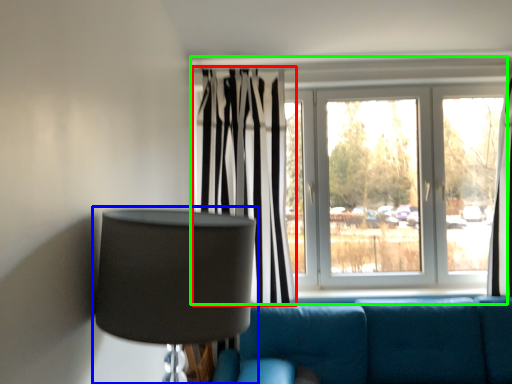
Question: Considering the real-world distances, which object is farthest from curtain (highlighted by a red box)? lamp (highlighted by a blue box) or window (highlighted by a green box)?

Choices:
 (A) lamp
 (B) window

Answer: (A)